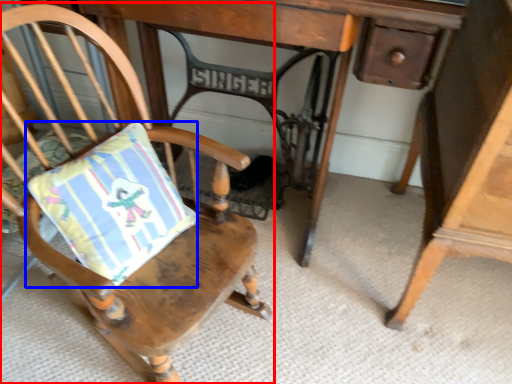
Question: Which object appears closest to the camera in this image, chair (highlighted by a red box) or pillow (highlighted by a blue box)?

Choices:
 (A) chair
 (B) pillow

Answer: (A)